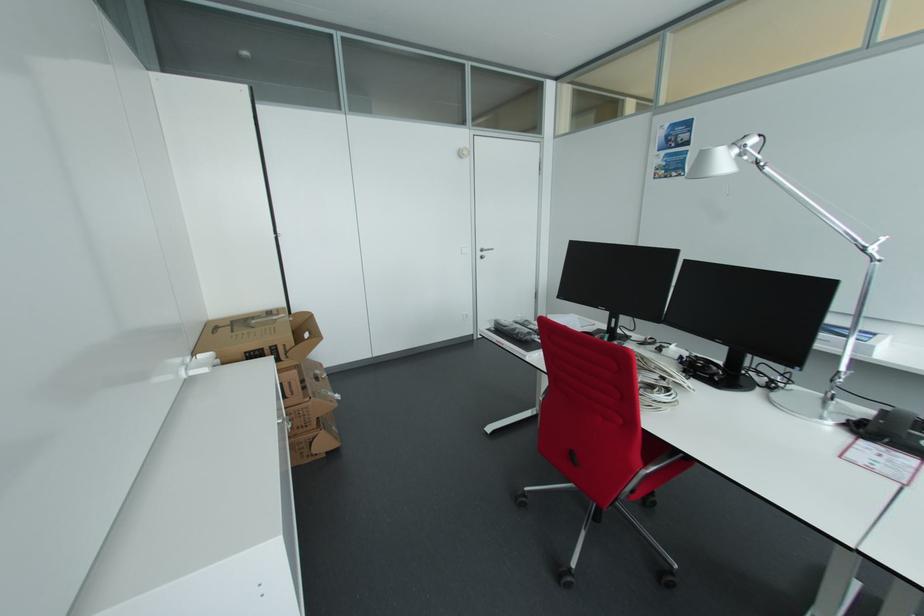
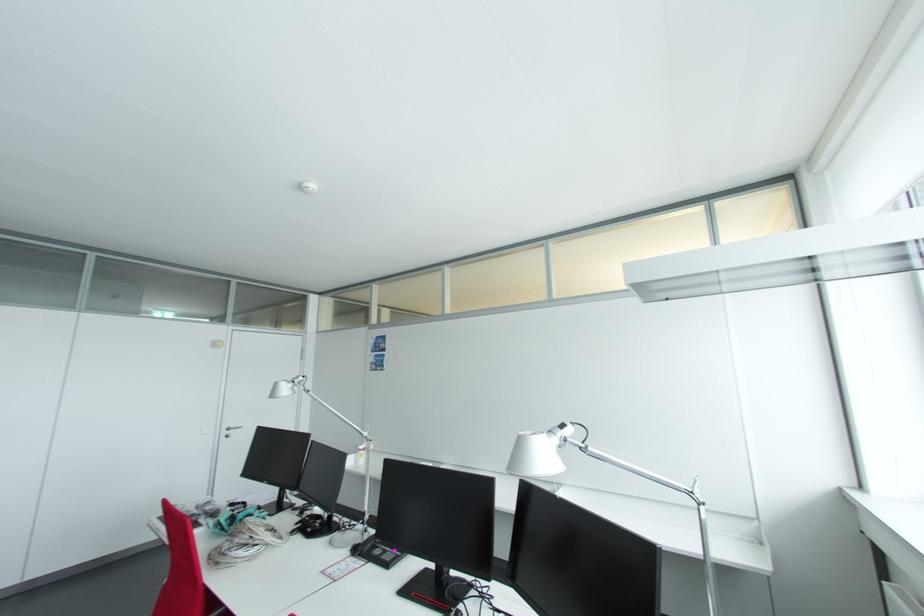
In the second image, find the point that corresponds to point (738, 152) in the first image.

(295, 385)